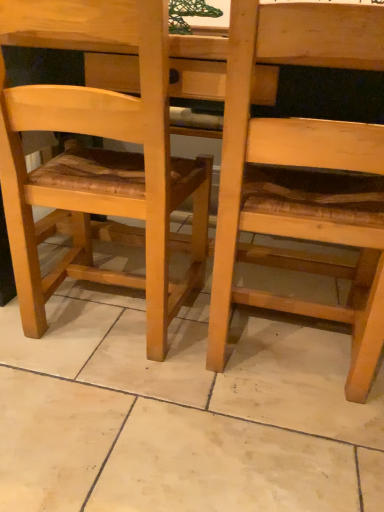
Identify the location of free space in front of natural wood chair at center. The height and width of the screenshot is (512, 384). (110, 424).